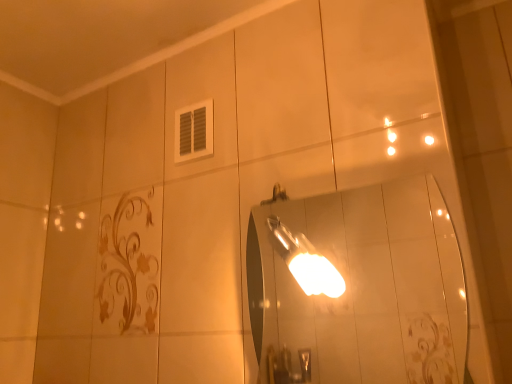
Question: From a real-world perspective, is metallic silver light fixture at center below glossy silver mirror at center?

Choices:
 (A) yes
 (B) no

Answer: (B)

Question: Is metallic silver light fixture at center at the left side of glossy silver mirror at center?

Choices:
 (A) yes
 (B) no

Answer: (A)

Question: Considering the relative sizes of metallic silver light fixture at center and glossy silver mirror at center in the image provided, is metallic silver light fixture at center bigger than glossy silver mirror at center?

Choices:
 (A) no
 (B) yes

Answer: (A)

Question: Is metallic silver light fixture at center thinner than glossy silver mirror at center?

Choices:
 (A) no
 (B) yes

Answer: (A)

Question: Is metallic silver light fixture at center completely or partially outside of glossy silver mirror at center?

Choices:
 (A) no
 (B) yes

Answer: (B)

Question: Considering the relative positions of metallic silver light fixture at center and glossy silver mirror at center in the image provided, is metallic silver light fixture at center behind glossy silver mirror at center?

Choices:
 (A) no
 (B) yes

Answer: (B)

Question: Is glossy silver mirror at center bigger than metallic silver light fixture at center?

Choices:
 (A) yes
 (B) no

Answer: (A)

Question: Can you confirm if glossy silver mirror at center is shorter than metallic silver light fixture at center?

Choices:
 (A) no
 (B) yes

Answer: (A)

Question: Is metallic silver light fixture at center located within glossy silver mirror at center?

Choices:
 (A) yes
 (B) no

Answer: (B)

Question: Could you tell me if glossy silver mirror at center is turned towards metallic silver light fixture at center?

Choices:
 (A) yes
 (B) no

Answer: (A)

Question: Is glossy silver mirror at center positioned before metallic silver light fixture at center?

Choices:
 (A) no
 (B) yes

Answer: (B)

Question: Is glossy silver mirror at center beside metallic silver light fixture at center?

Choices:
 (A) yes
 (B) no

Answer: (B)

Question: From a real-world perspective, relative to metallic silver light fixture at center, is glossy silver mirror at center vertically above or below?

Choices:
 (A) above
 (B) below

Answer: (B)